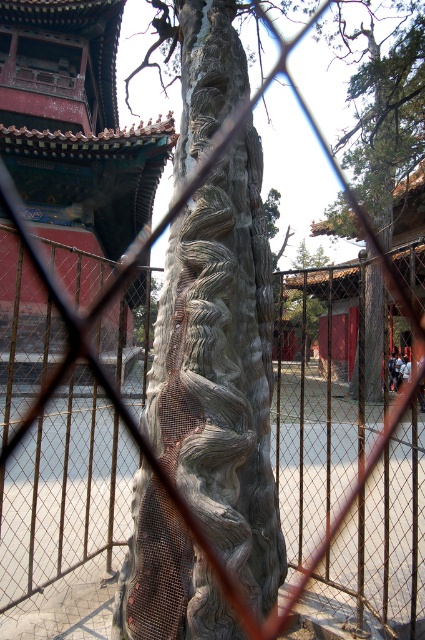
Question: Does gray textured stone at center appear on the left side of metal mesh fence at center?

Choices:
 (A) no
 (B) yes

Answer: (B)

Question: Which object is the closest to the matte red temple at upper left?

Choices:
 (A) gray textured bark at center
 (B) metal mesh fence at center

Answer: (B)

Question: Which object is closer to the camera taking this photo?

Choices:
 (A) gray textured bark at center
 (B) matte red temple at upper left
 (C) metal mesh fence at center
 (D) gray textured stone at center

Answer: (D)

Question: Where is metal mesh fence at center located in relation to gray textured bark at center in the image?

Choices:
 (A) above
 (B) below

Answer: (B)

Question: Does metal mesh fence at center appear on the right side of matte red temple at upper left?

Choices:
 (A) no
 (B) yes

Answer: (B)

Question: Which point is farther to the camera?

Choices:
 (A) matte red temple at upper left
 (B) gray textured stone at center

Answer: (A)